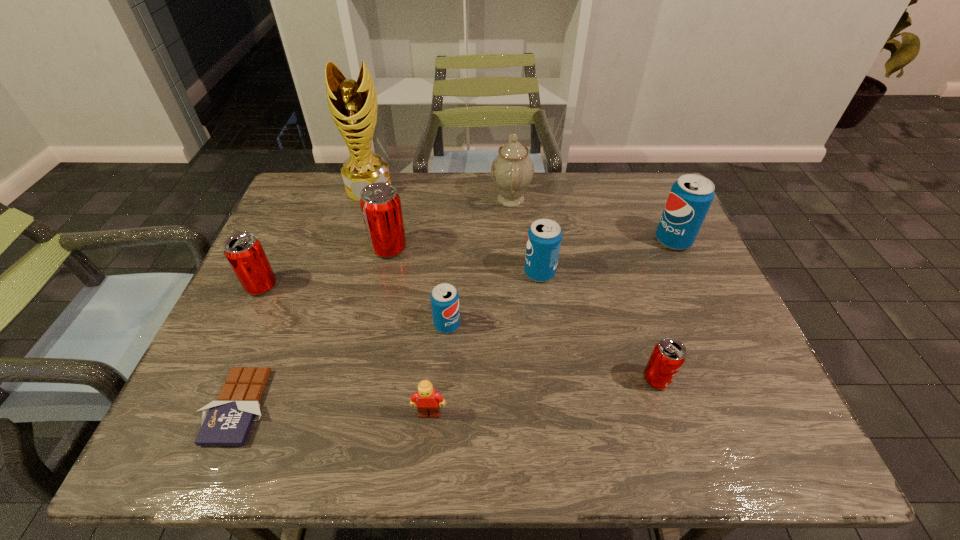
The width and height of the screenshot is (960, 540). In the image, there is a desktop. Identify the location of vacant space at the right edge. (736, 376).

Locate an element on the screen. The width and height of the screenshot is (960, 540). vacant region at the far left corner of the desktop is located at coordinates (314, 172).

I want to click on free space at the near right corner of the desktop, so click(x=721, y=423).

The image size is (960, 540). What are the coordinates of `free space between the chinaware and the gold award` in the screenshot? It's located at (440, 194).

This screenshot has width=960, height=540. In order to click on free area in between the second object from right to left and the shortest object in this screenshot , I will do `click(447, 393)`.

Find the location of `vacant space that is in between the fifth soda can from right to left and the shortest object`. vacant space that is in between the fifth soda can from right to left and the shortest object is located at coordinates (314, 328).

The height and width of the screenshot is (540, 960). I want to click on blank region between the chinaware and the second soda can from left to right, so click(x=450, y=224).

You are a GUI agent. You are given a task and a screenshot of the screen. Output one action in this format:
    pyautogui.click(x=<x>, y=<y>)
    Task: Click on the vacant region between the third soda can from right to left and the third soda can from left to right
    The height and width of the screenshot is (540, 960).
    Given the screenshot: What is the action you would take?
    pyautogui.click(x=493, y=299)

Locate an element on the screen. This screenshot has height=540, width=960. empty location between the chocolate bar and the leftmost red soda can is located at coordinates (251, 346).

You are a GUI agent. You are given a task and a screenshot of the screen. Output one action in this format:
    pyautogui.click(x=<x>, y=<y>)
    Task: Click on the empty space that is in between the second blue soda can from left to right and the second nearest soda can
    
    Given the screenshot: What is the action you would take?
    pyautogui.click(x=493, y=299)